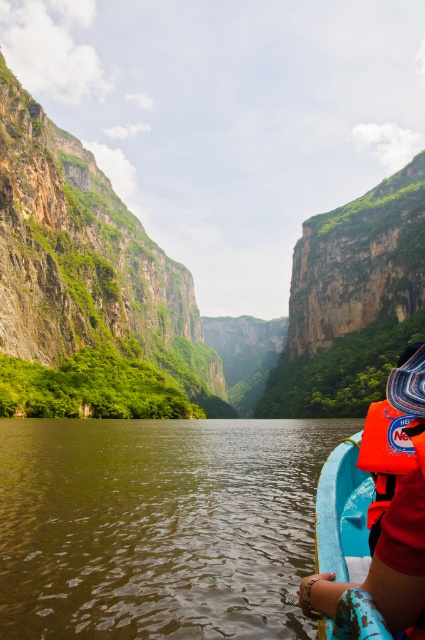
You are a hiker who has just arrived at the riverbank and need to board a boat. You see the orange life vest at lower right and the orange fabric life jacket at right. Which life preserver is closer to the water?

The orange life vest at lower right is closer to the water because it is positioned to the left of the orange fabric life jacket at right, and since they are both on the boat, being to the left places it nearer to the water edge.

You are a hiker who has just reached the edge of the river and see the orange life vest at lower right and the orange fabric life jacket at right. Which one is closer to you?

The orange life vest at lower right is closer to you because it is in front of the orange fabric life jacket at right.

You are a safety inspector checking the equipment on a boat. You notice two orange life jackets on the boat. The orange life vest at lower right and the orange fabric life jacket at right. Which one is bigger?

The orange life vest at lower right is larger in size than the orange fabric life jacket at right.